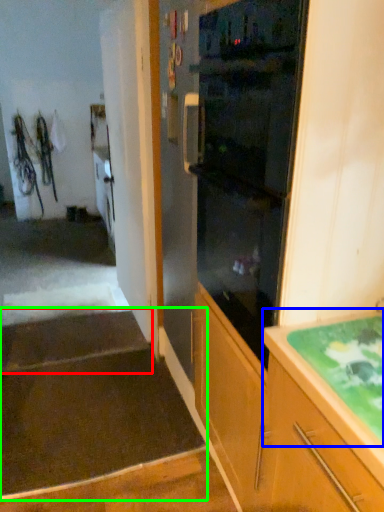
Question: Estimate the real-world distances between objects in this image. Which object is farther from stairwell (highlighted by a red box), countertop (highlighted by a blue box) or stairwell (highlighted by a green box)?

Choices:
 (A) countertop
 (B) stairwell

Answer: (A)